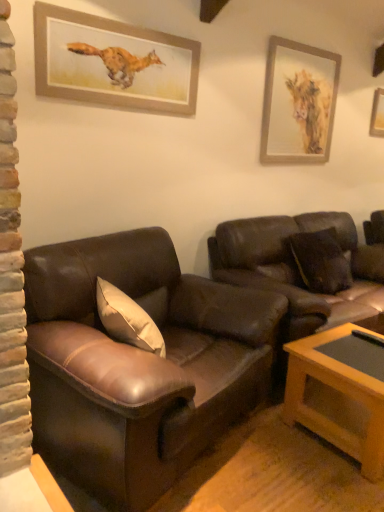
Question: In terms of width, does wooden coffee table at lower right look wider or thinner when compared to brown leather couch at center, the first studio couch viewed from the right?

Choices:
 (A) thin
 (B) wide

Answer: (A)

Question: Is wooden coffee table at lower right inside or outside of brown leather couch at center, acting as the second studio couch starting from the left?

Choices:
 (A) outside
 (B) inside

Answer: (A)

Question: Which is nearer to the brown leather couch at left, which is the first studio couch in left-to-right order?

Choices:
 (A) matte gold picture frame at upper right, which is the 2th picture frame from front to back
 (B) wooden picture frame at upper left, the 3th picture frame in the right-to-left sequence
 (C) wooden coffee table at lower right
 (D) wooden picture frame at upper right, which is counted as the first picture frame, starting from the back
 (E) brown leather couch at center, the first studio couch viewed from the right

Answer: (C)

Question: Which of these objects is positioned farthest from the brown leather couch at left, which is the first studio couch in left-to-right order?

Choices:
 (A) matte gold picture frame at upper right, positioned as the second picture frame in right-to-left order
 (B) wooden picture frame at upper right, the 3th picture frame in the left-to-right sequence
 (C) wooden picture frame at upper left, the third picture frame in the back-to-front sequence
 (D) brown leather couch at center, acting as the second studio couch starting from the left
 (E) wooden coffee table at lower right

Answer: (B)